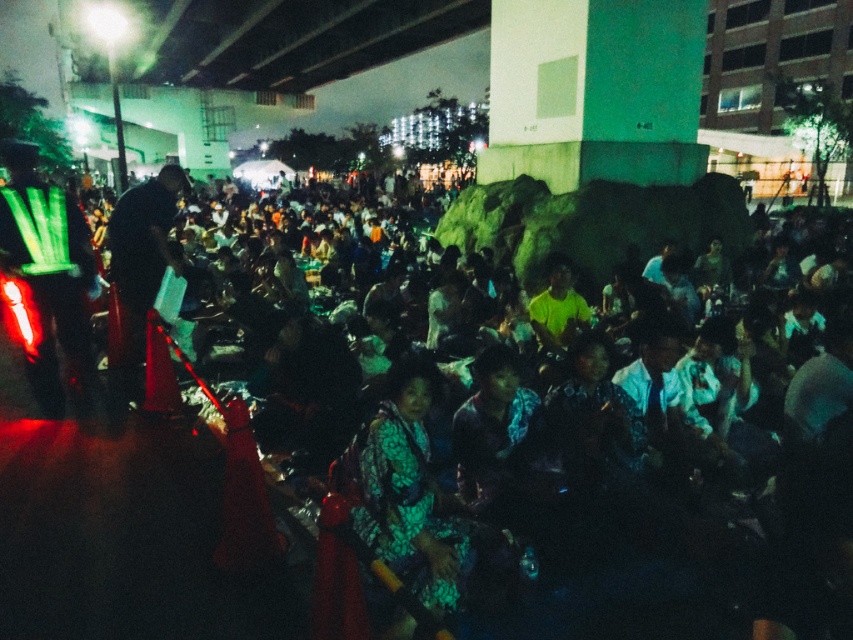
Question: Among these objects, which one is farthest from the camera?

Choices:
 (A) reflective green vest at left
 (B) dark blue fabric at center
 (C) printed fabric dress at center

Answer: (B)

Question: Does reflective green vest at left appear under dark blue fabric at center?

Choices:
 (A) no
 (B) yes

Answer: (B)

Question: Which object is the closest to the dark blue fabric at center?

Choices:
 (A) printed fabric dress at center
 (B) reflective green vest at left

Answer: (B)

Question: Which point appears farthest from the camera in this image?

Choices:
 (A) (361, 445)
 (B) (148, 216)
 (C) (84, 278)

Answer: (B)

Question: Is printed fabric dress at center thinner than dark blue fabric at center?

Choices:
 (A) no
 (B) yes

Answer: (A)

Question: Is reflective green vest at left further to camera compared to dark blue fabric at center?

Choices:
 (A) yes
 (B) no

Answer: (B)